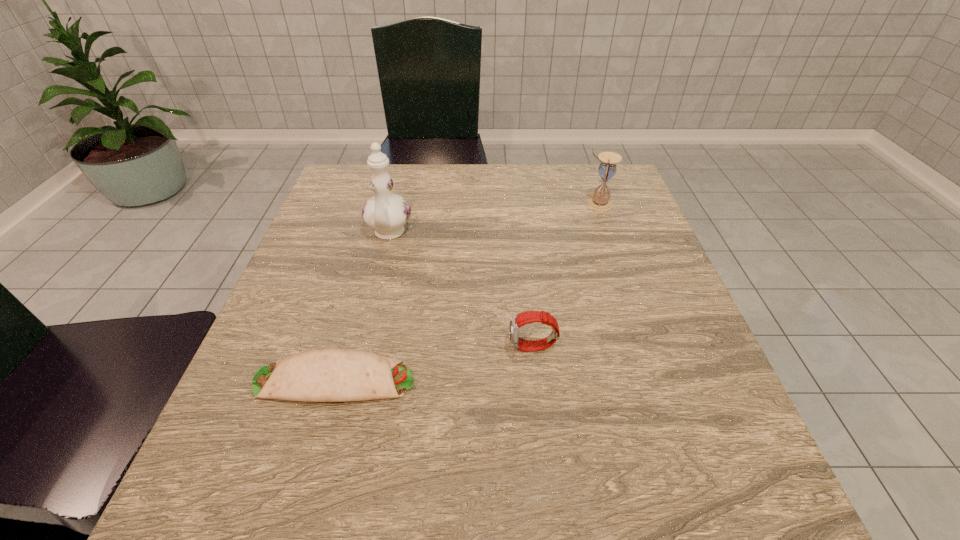
I want to click on unoccupied area between the second shortest object and the burrito, so click(434, 364).

Find the location of a particular element. Image resolution: width=960 pixels, height=540 pixels. free space between the second tallest object and the shortest object is located at coordinates (467, 292).

Image resolution: width=960 pixels, height=540 pixels. I want to click on empty space that is in between the burrito and the rightmost object, so click(467, 292).

Identify the location of empty space that is in between the tallest object and the shortest object. (362, 307).

Locate an element on the screen. free space that is in between the watch and the shortest object is located at coordinates (434, 364).

Locate which object is the second closest to the hourglass. Please provide its 2D coordinates. Your answer should be formatted as a tuple, i.e. [(x, y)], where the tuple contains the x and y coordinates of a point satisfying the conditions above.

[(387, 213)]

Find the location of a particular element. object that is the second closest to the tallest object is located at coordinates (516, 321).

Where is `free spot that satisfies the following two spatial constraints: 1. on the front side of the farthest object; 2. at the bitten end of the burrito`? Image resolution: width=960 pixels, height=540 pixels. free spot that satisfies the following two spatial constraints: 1. on the front side of the farthest object; 2. at the bitten end of the burrito is located at coordinates (659, 380).

Find the location of `vacant area in the image that satisfies the following two spatial constraints: 1. on the front side of the farthest object; 2. at the bitten end of the shortest object`. vacant area in the image that satisfies the following two spatial constraints: 1. on the front side of the farthest object; 2. at the bitten end of the shortest object is located at coordinates (659, 380).

Where is `vacant space that satisfies the following two spatial constraints: 1. at the spout of the third nearest object; 2. at the bitten end of the burrito`? vacant space that satisfies the following two spatial constraints: 1. at the spout of the third nearest object; 2. at the bitten end of the burrito is located at coordinates (352, 380).